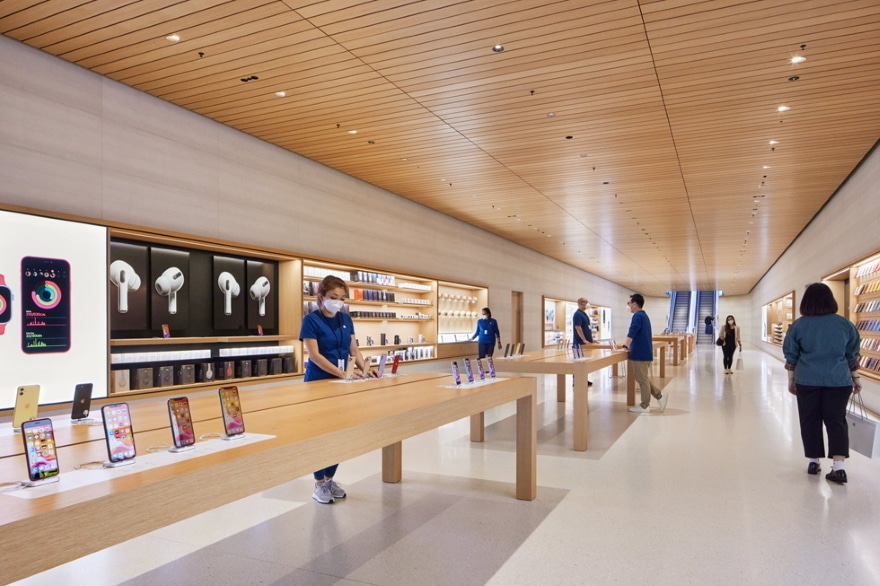
Where is `wall`? wall is located at coordinates (840, 223).